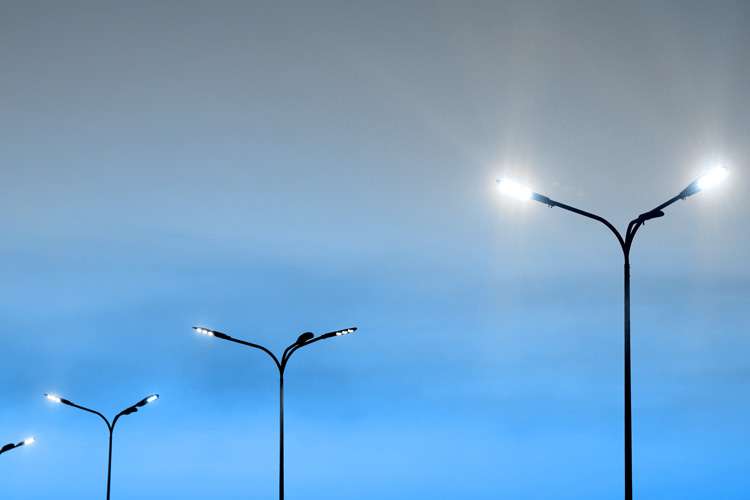
You are a GUI agent. You are given a task and a screenshot of the screen. Output one action in this format:
    pyautogui.click(x=<x>, y=<y>)
    Task: Click on the light
    The image size is (750, 500).
    Given the screenshot: What is the action you would take?
    pyautogui.click(x=28, y=441)